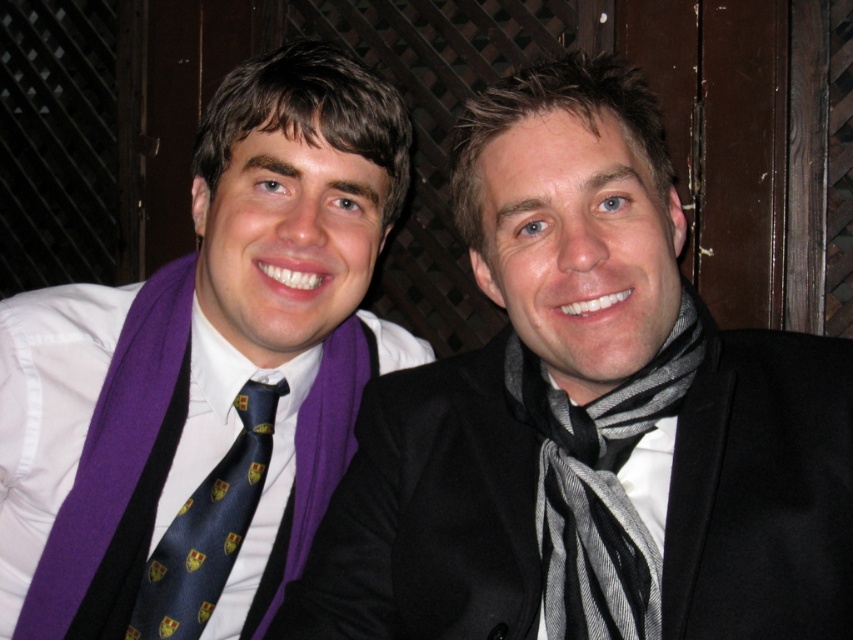
Question: In this image, where is purple fabric scarf at left located relative to dark blue silk tie at center?

Choices:
 (A) below
 (B) above

Answer: (B)

Question: Estimate the real-world distances between objects in this image. Which object is farther from the purple matte scarf at left?

Choices:
 (A) purple fabric scarf at left
 (B) dark blue silk tie at center

Answer: (A)

Question: Estimate the real-world distances between objects in this image. Which object is farther from the purple fabric scarf at left?

Choices:
 (A) dark blue silk tie at center
 (B) purple matte scarf at left

Answer: (A)

Question: Is purple matte scarf at left to the left of dark blue silk tie at center from the viewer's perspective?

Choices:
 (A) yes
 (B) no

Answer: (B)

Question: Does purple matte scarf at left have a lesser width compared to dark blue silk tie at center?

Choices:
 (A) yes
 (B) no

Answer: (B)

Question: Which point is farther to the camera?

Choices:
 (A) (544, 353)
 (B) (35, 304)

Answer: (B)